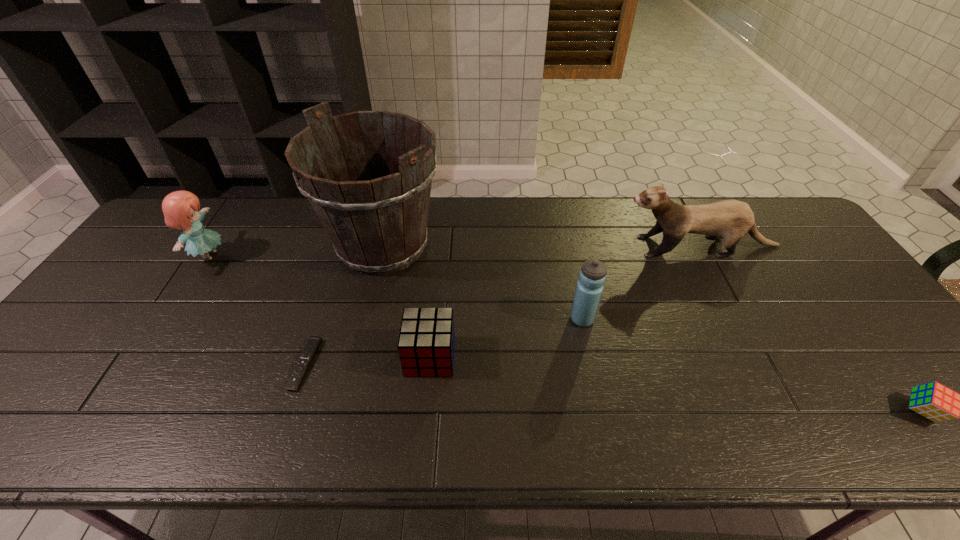
Identify the location of doll at the far edge. This screenshot has width=960, height=540. (180, 208).

Identify the location of ferret situated at the far edge. (730, 220).

You are a GUI agent. You are given a task and a screenshot of the screen. Output one action in this format:
    pyautogui.click(x=<x>, y=<y>)
    Task: Click on the object that is at the near edge
    
    Given the screenshot: What is the action you would take?
    pyautogui.click(x=933, y=400)

Identify the location of ferret positioned at the right edge. The width and height of the screenshot is (960, 540). (730, 220).

The width and height of the screenshot is (960, 540). What are the coordinates of `cube present at the right edge` in the screenshot? It's located at (933, 400).

Where is `object present at the far right corner`? The height and width of the screenshot is (540, 960). object present at the far right corner is located at coordinates (730, 220).

Image resolution: width=960 pixels, height=540 pixels. I want to click on object positioned at the near right corner, so click(x=933, y=400).

Identify the location of vacant region at the far edge of the desktop. [278, 221].

The width and height of the screenshot is (960, 540). What are the coordinates of `vacant space at the near edge` in the screenshot? It's located at (237, 415).

The image size is (960, 540). In the image, there is a desktop. Identify the location of vacant space at the left edge. (57, 357).